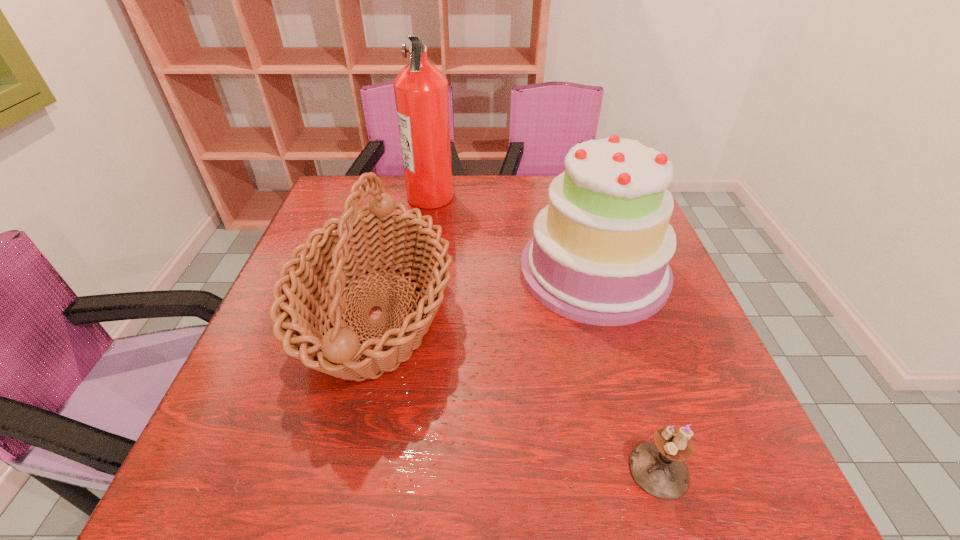
What are the coordinates of `object located at the far edge` in the screenshot? It's located at (421, 93).

Where is `object located in the near edge section of the desktop`? object located in the near edge section of the desktop is located at coordinates (659, 468).

Find the location of a particular element. object positioned at the left edge is located at coordinates (358, 240).

Identify the location of cake present at the right edge. (600, 253).

Locate an element on the screen. The height and width of the screenshot is (540, 960). candle holder that is at the right edge is located at coordinates (659, 468).

You are a GUI agent. You are given a task and a screenshot of the screen. Output one action in this format:
    pyautogui.click(x=<x>, y=<y>)
    Task: Click on the object situated at the near right corner
    
    Given the screenshot: What is the action you would take?
    point(659,468)

The width and height of the screenshot is (960, 540). Find the location of `free space at the far edge of the desktop`. free space at the far edge of the desktop is located at coordinates (521, 179).

The height and width of the screenshot is (540, 960). In the image, there is a desktop. In order to click on vacant space at the right edge in this screenshot , I will do `click(678, 325)`.

I want to click on free space at the far left corner, so click(341, 193).

This screenshot has height=540, width=960. In order to click on vacant point located between the nearest object and the tallest object in this screenshot , I will do `click(544, 333)`.